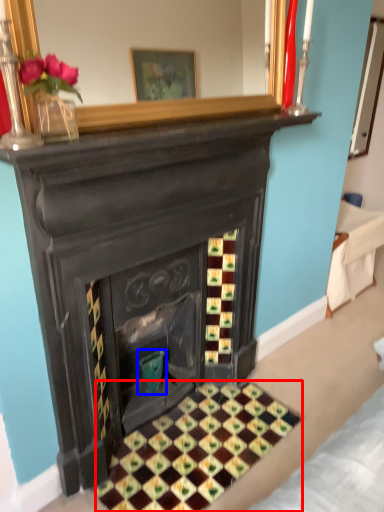
Question: Which point is closer to the camera, pattern (highlighted by a red box) or teal (highlighted by a blue box)?

Choices:
 (A) pattern
 (B) teal

Answer: (A)